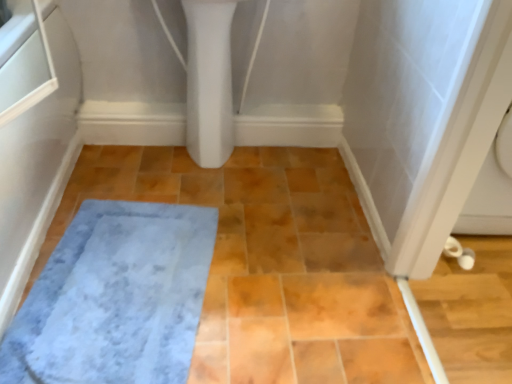
Image resolution: width=512 pixels, height=384 pixels. Identify the location of vacant space in white glossy bidet at upper center (from a real-world perspective). (212, 164).